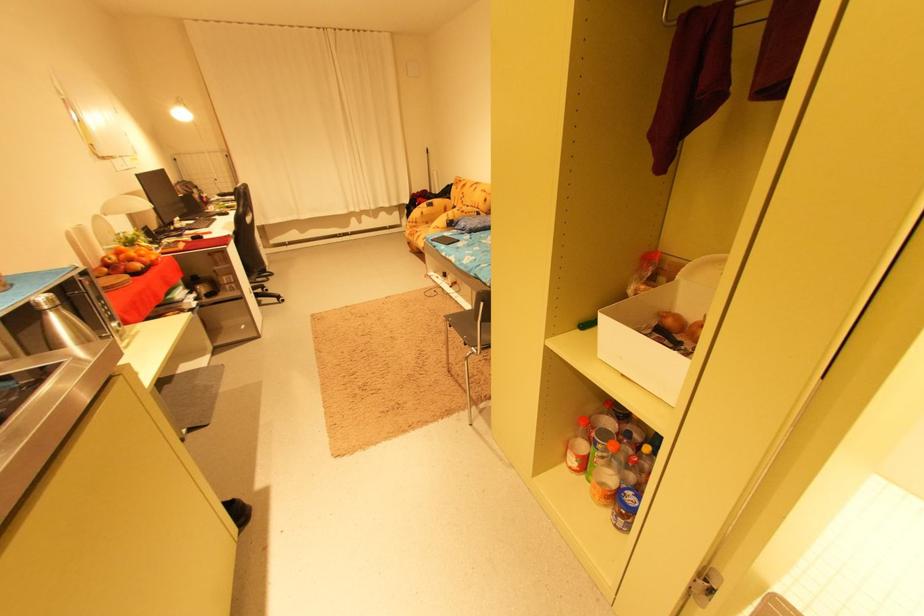
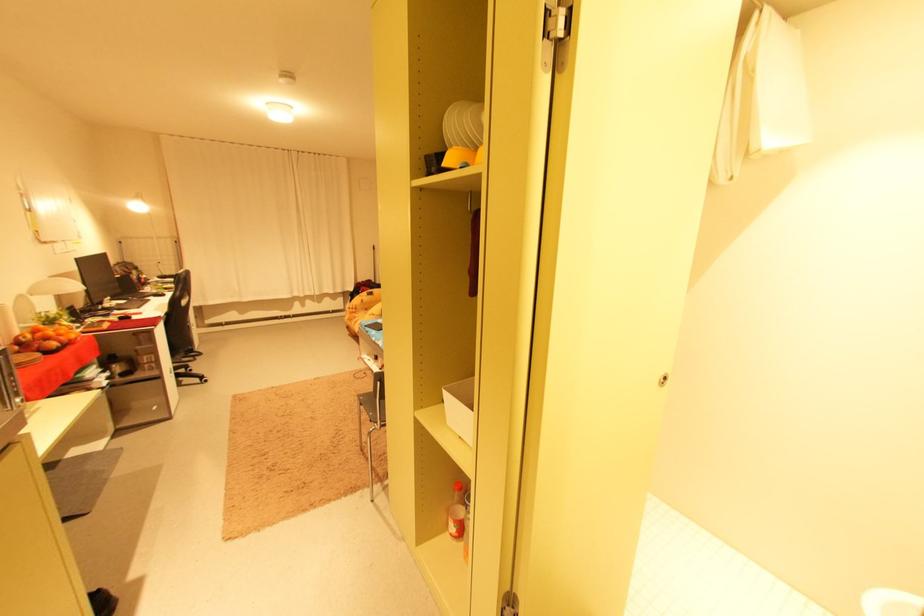
In the second image, find the point that corresponds to (x=572, y=467) in the first image.

(455, 536)